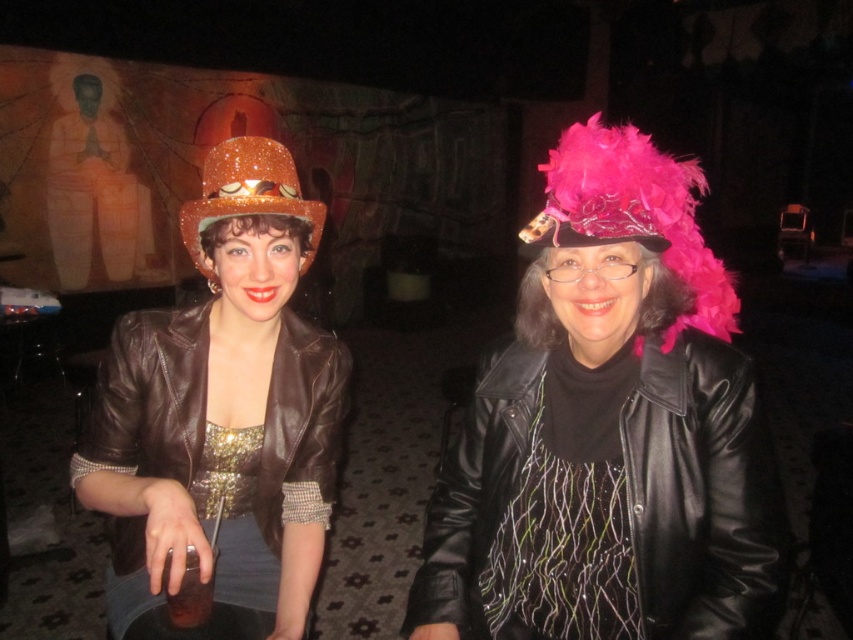
You are at a party and want to take a photo of the matte gold statue at upper left and the pink feathered wig at center. Which object should you focus on first to ensure both are in the frame?

The matte gold statue at upper left is positioned on the left side of the pink feathered wig at center, so you should focus on the matte gold statue at upper left first to ensure both are in the frame.